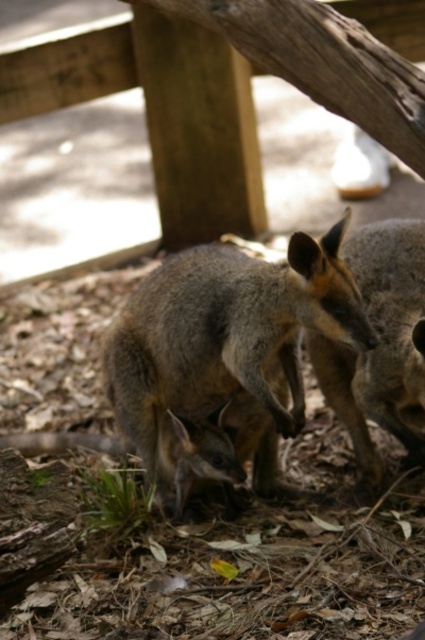
Question: Is gray fur kangaroo at center smaller than brown fur kangaroo at center?

Choices:
 (A) yes
 (B) no

Answer: (B)

Question: Which point is closer to the camera?

Choices:
 (A) (249, 442)
 (B) (340, 404)

Answer: (A)

Question: Considering the relative positions of gray fur kangaroo at center and brown fur kangaroo at center in the image provided, where is gray fur kangaroo at center located with respect to brown fur kangaroo at center?

Choices:
 (A) below
 (B) above

Answer: (A)

Question: Does gray fur kangaroo at center appear over brown fur kangaroo at center?

Choices:
 (A) no
 (B) yes

Answer: (A)

Question: Which of the following is the closest to the observer?

Choices:
 (A) brown fur kangaroo at center
 (B) gray fur kangaroo at center

Answer: (B)